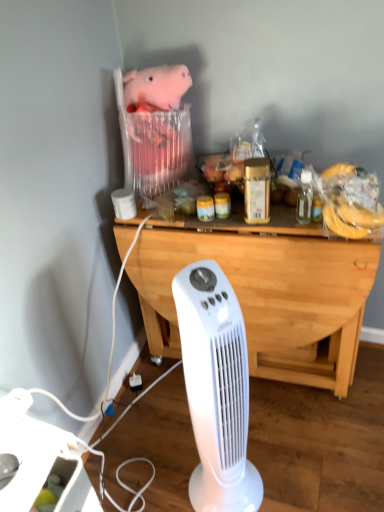
At what (x,y) coordinates should I click in order to perform the action: click on vacant space behind white plastic fan at center. Please return your answer as a coordinate pair (x, y). This screenshot has width=384, height=512. Looking at the image, I should click on (190, 440).